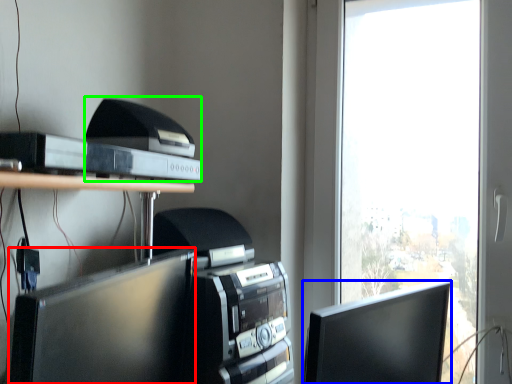
Question: Which object is the closest to the computer monitor (highlighted by a red box)? Choose among these: computer monitor (highlighted by a blue box) or printer (highlighted by a green box).

Choices:
 (A) computer monitor
 (B) printer

Answer: (B)